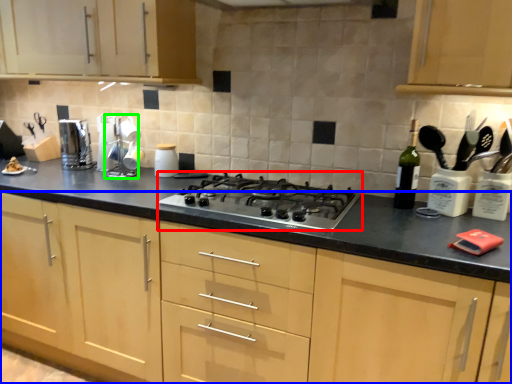
Question: Considering the real-world distances, which object is closest to gas stove (highlighted by a red box)? cabinetry (highlighted by a blue box) or appliance (highlighted by a green box).

Choices:
 (A) cabinetry
 (B) appliance

Answer: (A)